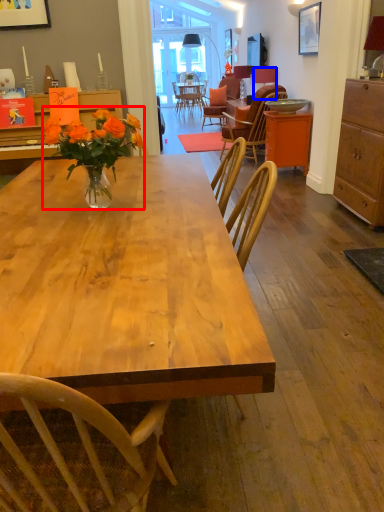
Question: Which point is closer to the camera, floral arrangement (highlighted by a red box) or lamp (highlighted by a blue box)?

Choices:
 (A) floral arrangement
 (B) lamp

Answer: (A)